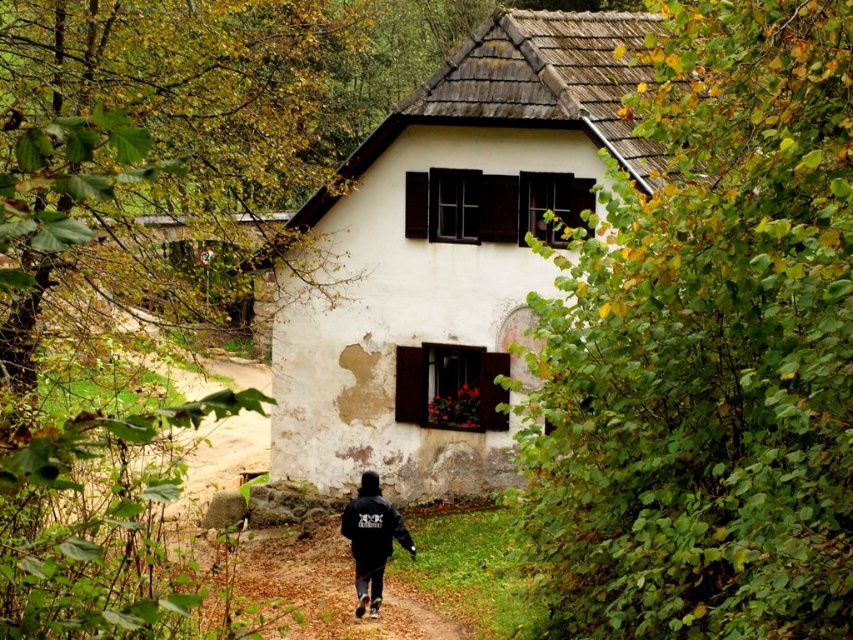
Is black matte jacket at lower center below black matte sweatshirt at lower center?

Indeed, black matte jacket at lower center is positioned under black matte sweatshirt at lower center.

Is point (374, 502) positioned behind point (387, 545)?

No, (374, 502) is in front of (387, 545).

Find the location of a particular element. black matte jacket at lower center is located at coordinates (370, 540).